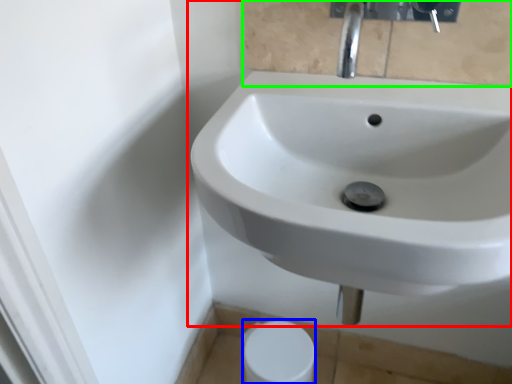
Question: Considering the real-world distances, which object is farthest from sink (highlighted by a red box)? toilet paper (highlighted by a blue box) or mirror (highlighted by a green box)?

Choices:
 (A) toilet paper
 (B) mirror

Answer: (A)